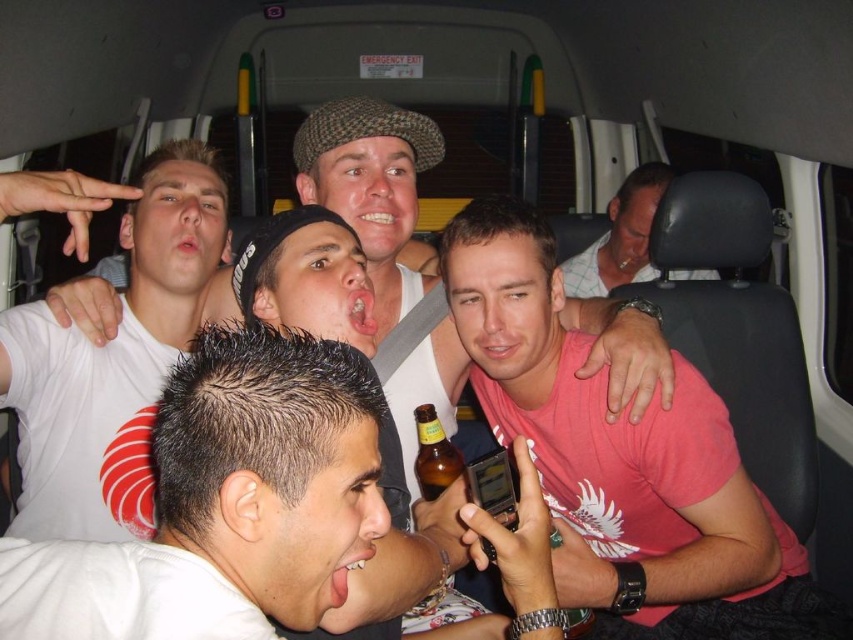
You are inside the van and want to reach the point closer to you. Which of the two points, point (50,433) or point (672,176), should you go to?

Point (50,433) is closer to the viewer than point (672,176), so you should go to point (50,433).